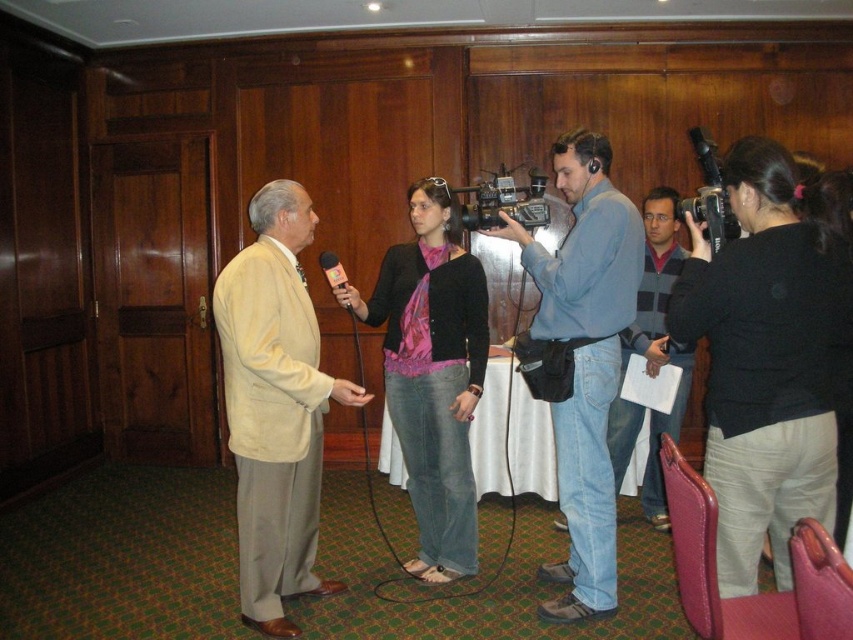
Who is higher up, beige fabric suit at center or metallic pink microphone at center?

metallic pink microphone at center

Is beige fabric suit at center wider than metallic pink microphone at center?

Yes.

Between point (308, 465) and point (345, 280), which one is positioned in front?

Point (345, 280) is in front.

Locate an element on the screen. beige fabric suit at center is located at coordinates (276, 404).

Who is shorter, blue denim jeans at center or metallic pink microphone at center?

Standing shorter between the two is metallic pink microphone at center.

Is point (581, 268) positioned before point (347, 280)?

Yes, point (581, 268) is in front of point (347, 280).

Where is `blue denim jeans at center`? This screenshot has height=640, width=853. blue denim jeans at center is located at coordinates (581, 358).

In order to click on blue denim jeans at center in this screenshot , I will do `click(581, 358)`.

Does point (595, 250) come in front of point (621, 426)?

Yes, point (595, 250) is closer to viewer.

This screenshot has height=640, width=853. Find the location of `blue denim jeans at center`. blue denim jeans at center is located at coordinates (581, 358).